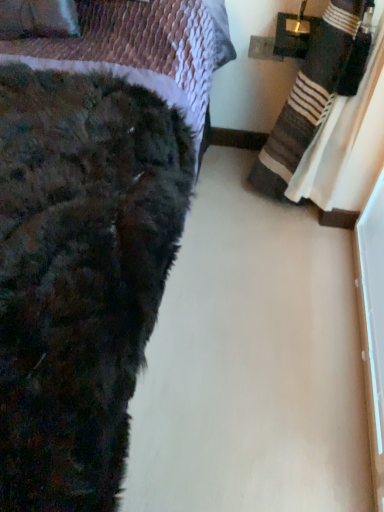
In order to face striped cotton blanket at right, should I rotate leftwards or rightwards?

A 15.026 degree turn to the right will do.

Locate an element on the screen. This screenshot has height=512, width=384. velvet purple throw pillow at upper left is located at coordinates (38, 19).

Is velvet purple throw pillow at upper left far from fuzzy black blanket at lower left?

Actually, velvet purple throw pillow at upper left and fuzzy black blanket at lower left are a little close together.

How many degrees apart are the facing directions of velvet purple throw pillow at upper left and fuzzy black blanket at lower left?

7.01 degrees separate the facing orientations of velvet purple throw pillow at upper left and fuzzy black blanket at lower left.

Looking at this image, from the image's perspective, is velvet purple throw pillow at upper left on top of fuzzy black blanket at lower left?

Yes.

Is velvet purple throw pillow at upper left situated inside fuzzy black blanket at lower left or outside?

velvet purple throw pillow at upper left is inside fuzzy black blanket at lower left.

Image resolution: width=384 pixels, height=512 pixels. What are the coordinates of `bed that appears below the velvet purple throw pillow at upper left (from the image's perspective)` in the screenshot? It's located at (91, 232).

Which is more to the right, fuzzy black blanket at lower left or velvet purple throw pillow at upper left?

fuzzy black blanket at lower left.

Looking at this image, is fuzzy black blanket at lower left positioned far away from velvet purple throw pillow at upper left?

They are positioned close to each other.

Which of these two, fuzzy black blanket at lower left or velvet purple throw pillow at upper left, is wider?

Wider between the two is fuzzy black blanket at lower left.

Looking at this image, which object is closer to the camera taking this photo, striped cotton blanket at right or velvet purple throw pillow at upper left?

striped cotton blanket at right is in front.

Considering the points (363, 70) and (64, 12), which point is behind, point (363, 70) or point (64, 12)?

The point (363, 70) is farther from the camera.

From the image's perspective, which is above, striped cotton blanket at right or velvet purple throw pillow at upper left?

velvet purple throw pillow at upper left, from the image's perspective.

How distant is striped cotton blanket at right from velvet purple throw pillow at upper left?

striped cotton blanket at right and velvet purple throw pillow at upper left are 32.94 inches apart from each other.

From the image's perspective, which one is positioned lower, velvet purple throw pillow at upper left or striped cotton blanket at right?

From the image's view, striped cotton blanket at right is below.

Is velvet purple throw pillow at upper left taller than striped cotton blanket at right?

In fact, velvet purple throw pillow at upper left may be shorter than striped cotton blanket at right.

Can you see velvet purple throw pillow at upper left touching striped cotton blanket at right?

velvet purple throw pillow at upper left is not next to striped cotton blanket at right, and they're not touching.

Does velvet purple throw pillow at upper left have a smaller size compared to striped cotton blanket at right?

Yes.

Is fuzzy black blanket at lower left located outside striped cotton blanket at right?

Yes, fuzzy black blanket at lower left is located beyond the bounds of striped cotton blanket at right.

Which is closer to the camera, (x=132, y=308) or (x=263, y=166)?

Point (x=132, y=308) is positioned closer to the camera compared to point (x=263, y=166).

Where is `bed below the striped cotton blanket at right (from the image's perspective)`? Image resolution: width=384 pixels, height=512 pixels. bed below the striped cotton blanket at right (from the image's perspective) is located at coordinates (91, 232).

From a real-world perspective, is striped cotton blanket at right above or below fuzzy black blanket at lower left?

In terms of real-world spatial position, striped cotton blanket at right is below fuzzy black blanket at lower left.

Which of these two, striped cotton blanket at right or fuzzy black blanket at lower left, stands taller?

With more height is fuzzy black blanket at lower left.

The height and width of the screenshot is (512, 384). What are the coordinates of `bed below the striped cotton blanket at right (from the image's perspective)` in the screenshot? It's located at (91, 232).

Find the location of a particular element. throw pillow that appears on the left of fuzzy black blanket at lower left is located at coordinates (38, 19).

Where is `bed lying below the velvet purple throw pillow at upper left (from the image's perspective)`? bed lying below the velvet purple throw pillow at upper left (from the image's perspective) is located at coordinates (91, 232).

Looking at the image, which one is located further to striped cotton blanket at right, fuzzy black blanket at lower left or velvet purple throw pillow at upper left?

velvet purple throw pillow at upper left.

Looking at the image, which one is located further to striped cotton blanket at right, velvet purple throw pillow at upper left or fuzzy black blanket at lower left?

velvet purple throw pillow at upper left lies further to striped cotton blanket at right than the other object.

Which object lies nearer to the anchor point fuzzy black blanket at lower left, striped cotton blanket at right or velvet purple throw pillow at upper left?

velvet purple throw pillow at upper left is positioned closer to the anchor fuzzy black blanket at lower left.

Based on their spatial positions, is velvet purple throw pillow at upper left or striped cotton blanket at right closer to fuzzy black blanket at lower left?

Based on the image, velvet purple throw pillow at upper left appears to be nearer to fuzzy black blanket at lower left.

When comparing their distances from velvet purple throw pillow at upper left, does striped cotton blanket at right or fuzzy black blanket at lower left seem closer?

Based on the image, fuzzy black blanket at lower left appears to be nearer to velvet purple throw pillow at upper left.

In the scene shown: When comparing their distances from velvet purple throw pillow at upper left, does fuzzy black blanket at lower left or striped cotton blanket at right seem further?

Based on the image, striped cotton blanket at right appears to be further to velvet purple throw pillow at upper left.

The height and width of the screenshot is (512, 384). Find the location of `blanket between fuzzy black blanket at lower left and velvet purple throw pillow at upper left along the z-axis`. blanket between fuzzy black blanket at lower left and velvet purple throw pillow at upper left along the z-axis is located at coordinates (315, 92).